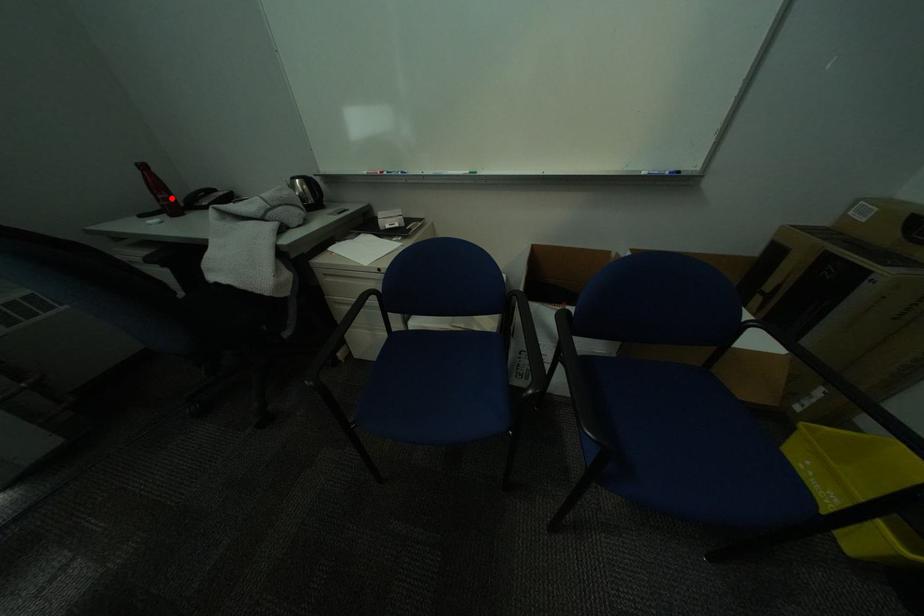
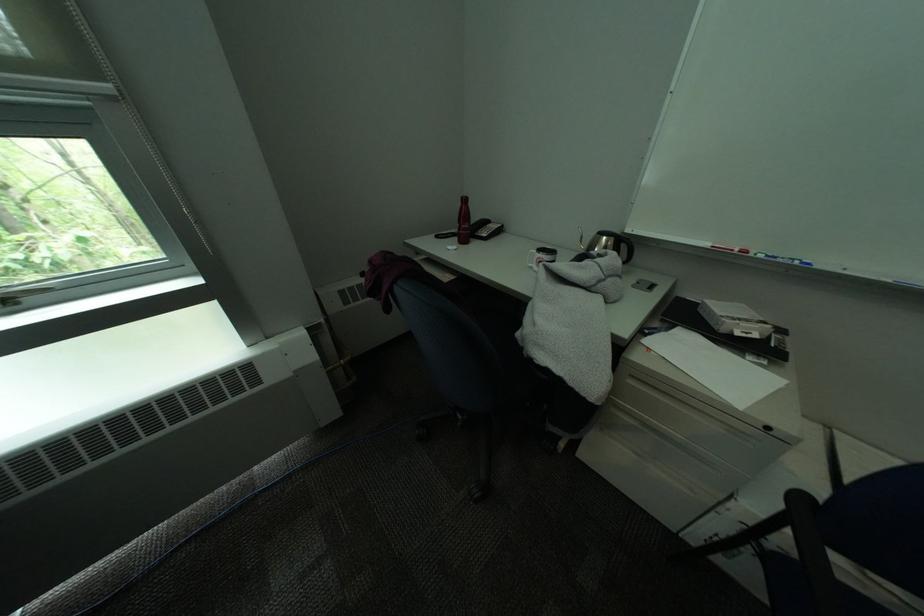
The point at the highlighted location is marked in the first image. Where is the corresponding point in the second image?

(475, 228)